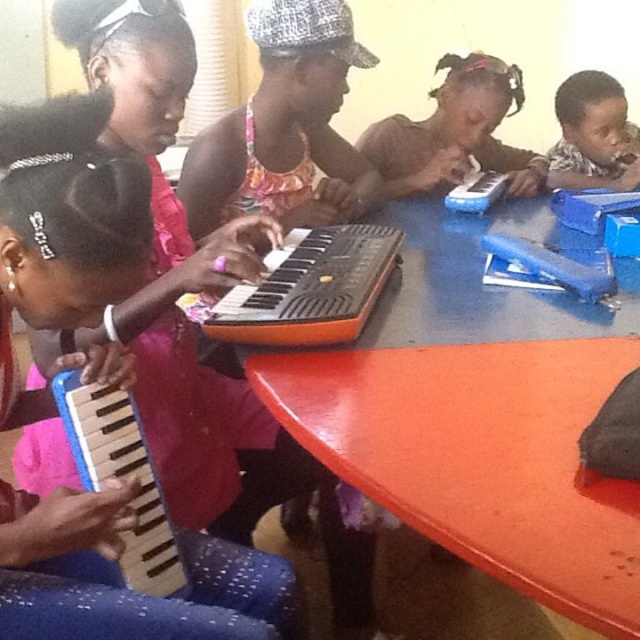
Can you confirm if wooden accordion at lower left is thinner than matte blue toy piano at upper right?

Yes.

Is point (170, 573) farther from camera compared to point (568, 81)?

That is False.

Between point (164, 529) and point (580, 172), which one is positioned behind?

The point (580, 172) is behind.

What are the coordinates of `wooden accordion at lower left` in the screenshot? It's located at (122, 476).

Is orange plastic keyboard at center taller than matte plastic keyboard at upper center?

No.

Is orange plastic keyboard at center positioned behind matte plastic keyboard at upper center?

No, orange plastic keyboard at center is closer to the viewer.

Who is more forward, [316,294] or [440,106]?

Point [316,294]

Locate an element on the screen. The height and width of the screenshot is (640, 640). orange plastic keyboard at center is located at coordinates (310, 289).

This screenshot has width=640, height=640. What do you see at coordinates (64, 227) in the screenshot?
I see `blue plastic keyboard at lower left` at bounding box center [64, 227].

Locate an element on the screen. The height and width of the screenshot is (640, 640). blue plastic keyboard at lower left is located at coordinates [64, 227].